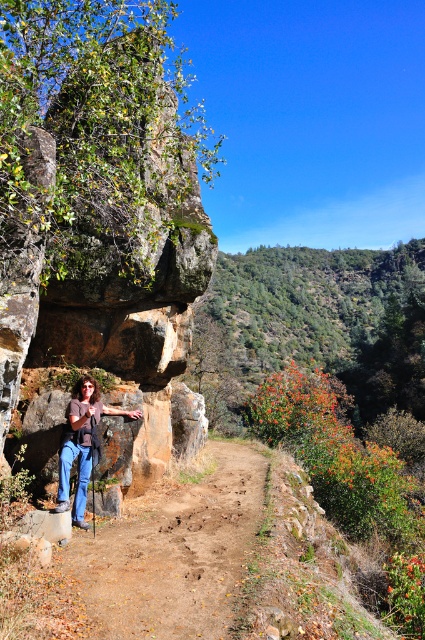
Question: Which of these objects is positioned farthest from the matte brown shirt at center?

Choices:
 (A) dirt path at center
 (B) brown rough rock at left

Answer: (B)

Question: Which point appears farthest from the camera in this image?

Choices:
 (A) (87, 404)
 (B) (163, 522)

Answer: (A)

Question: Which object is the farthest from the brown rough rock at left?

Choices:
 (A) matte brown shirt at center
 (B) dirt path at center

Answer: (B)

Question: Does dirt path at center appear under matte brown shirt at center?

Choices:
 (A) yes
 (B) no

Answer: (A)

Question: Is the position of brown rough rock at left less distant than that of matte brown shirt at center?

Choices:
 (A) no
 (B) yes

Answer: (B)

Question: Can you confirm if brown rough rock at left is positioned to the right of dirt path at center?

Choices:
 (A) yes
 (B) no

Answer: (B)